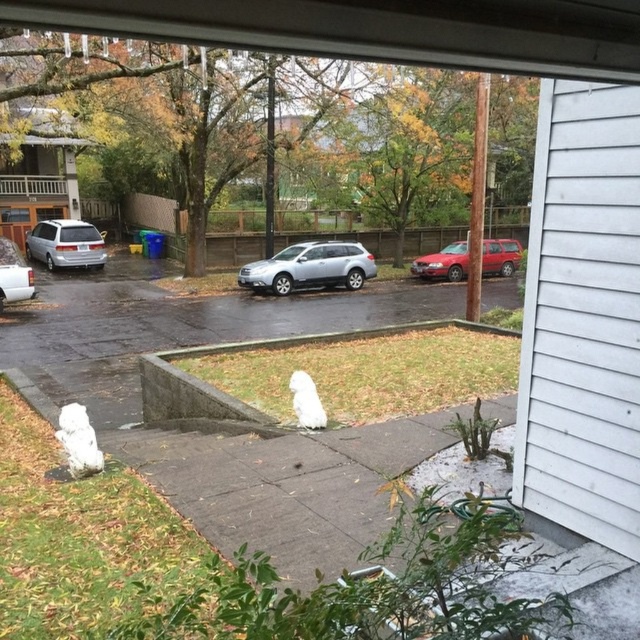
Question: Can you confirm if matte silver minivan at left is bigger than matte red station wagon at center?

Choices:
 (A) no
 (B) yes

Answer: (B)

Question: Which of these objects is positioned closest to the matte silver minivan at left?

Choices:
 (A) wet asphalt pavement at center
 (B) satin silver suv at center
 (C) white fluffy ghost at center
 (D) matte red station wagon at center

Answer: (A)

Question: Is matte red station wagon at center to the right of silver metallic suv at left from the viewer's perspective?

Choices:
 (A) no
 (B) yes

Answer: (B)

Question: Which object appears closest to the camera in this image?

Choices:
 (A) wet asphalt pavement at center
 (B) satin silver suv at center

Answer: (A)

Question: Estimate the real-world distances between objects in this image. Which object is closer to the matte red station wagon at center?

Choices:
 (A) wet asphalt pavement at center
 (B) satin silver suv at center
 (C) matte silver minivan at left

Answer: (B)

Question: Is silver metallic suv at left wider than white fluffy ghost at center?

Choices:
 (A) yes
 (B) no

Answer: (A)